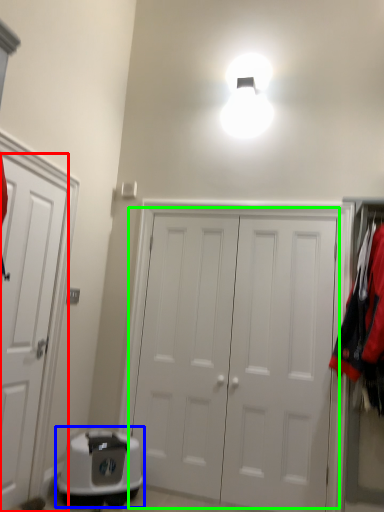
Question: Estimate the real-world distances between objects in this image. Which object is closer to door (highlighted by a red box), appliance (highlighted by a blue box) or door (highlighted by a green box)?

Choices:
 (A) appliance
 (B) door

Answer: (A)